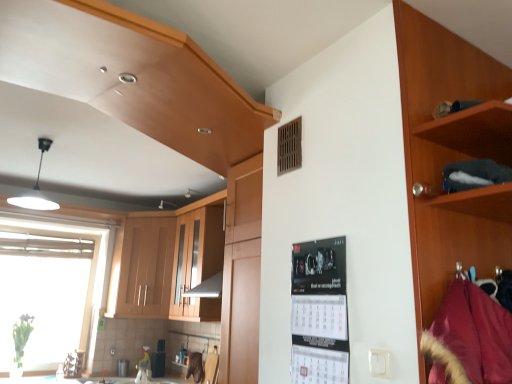
What do you see at coordinates (50, 288) in the screenshot?
I see `transparent glass window at left` at bounding box center [50, 288].

This screenshot has width=512, height=384. What do you see at coordinates (198, 258) in the screenshot? I see `matte wood cabinet at center, the second cabinetry when ordered from front to back` at bounding box center [198, 258].

The width and height of the screenshot is (512, 384). Describe the element at coordinates (142, 268) in the screenshot. I see `wooden cabinet at upper left, positioned as the 1th cabinetry in left-to-right order` at that location.

In the scene shown: Measure the distance between point (380,369) and camera.

Point (380,369) is 4.16 feet away from camera.

The width and height of the screenshot is (512, 384). What do you see at coordinates (469, 338) in the screenshot?
I see `velvet burgundy coat at right` at bounding box center [469, 338].

Locate an element on the screen. Image resolution: width=512 pixels, height=384 pixels. wooden cabinet at right, which ranks as the third cabinetry in left-to-right order is located at coordinates (451, 155).

Do you think transparent glass window at left is within white glossy countertop at lower center, or outside of it?

transparent glass window at left cannot be found inside white glossy countertop at lower center.

From the picture: Between transparent glass window at left and white glossy countertop at lower center, which one has smaller width?

transparent glass window at left is thinner.

Does point (94, 313) come in front of point (164, 379)?

That is False.

Which object is further away from the camera, transparent glass window at left or white glossy countertop at lower center?

transparent glass window at left is more distant.

How far apart are transparent glass window at left and dark brown wood at upper right?

transparent glass window at left is 3.98 meters away from dark brown wood at upper right.

Which object is closer to the camera taking this photo, transparent glass window at left or dark brown wood at upper right?

dark brown wood at upper right is closer to the camera.

Considering the sizes of objects transparent glass window at left and dark brown wood at upper right in the image provided, who is taller, transparent glass window at left or dark brown wood at upper right?

Standing taller between the two is transparent glass window at left.

From the image's perspective, would you say black paper calendar at center is shown under matte wood cabinet at center, the 2th cabinetry viewed from the left?

No, from the image's perspective, black paper calendar at center is not beneath matte wood cabinet at center, the 2th cabinetry viewed from the left.

Is black paper calendar at center in front of or behind matte wood cabinet at center, the second cabinetry positioned from the right, in the image?

black paper calendar at center is positioned closer to the viewer than matte wood cabinet at center, the second cabinetry positioned from the right.

From a real-world perspective, is black paper calendar at center above or below matte wood cabinet at center, which appears as the second cabinetry when viewed from the back?

In terms of real-world spatial position, black paper calendar at center is below matte wood cabinet at center, which appears as the second cabinetry when viewed from the back.

Between point (298, 353) and point (220, 195), which one is positioned in front?

The point (298, 353) is closer.

Is velvet burgundy coat at right not within matte wood cabinet at center, which appears as the second cabinetry when viewed from the back?

Yes, velvet burgundy coat at right is not within matte wood cabinet at center, which appears as the second cabinetry when viewed from the back.

Between velvet burgundy coat at right and matte wood cabinet at center, the second cabinetry when ordered from front to back, which one has less height?

velvet burgundy coat at right.

How many degrees apart are the facing directions of velvet burgundy coat at right and matte wood cabinet at center, which appears as the second cabinetry when viewed from the back?

The facing directions of velvet burgundy coat at right and matte wood cabinet at center, which appears as the second cabinetry when viewed from the back, are 91.9 degrees apart.

Based on their positions, is velvet burgundy coat at right located to the left or right of matte wood cabinet at center, the second cabinetry when ordered from front to back?

velvet burgundy coat at right is to the right of matte wood cabinet at center, the second cabinetry when ordered from front to back.

Do you think white plastic electric outlet at lower right is within black paper calendar at center, or outside of it?

white plastic electric outlet at lower right is not inside black paper calendar at center, it's outside.

Based on the photo, is white plastic electric outlet at lower right oriented away from black paper calendar at center?

No, white plastic electric outlet at lower right is not facing away from black paper calendar at center.

From a real-world perspective, is white plastic electric outlet at lower right above or below black paper calendar at center?

white plastic electric outlet at lower right is below black paper calendar at center.

In the image, is white plastic electric outlet at lower right positioned in front of or behind black paper calendar at center?

white plastic electric outlet at lower right is in front of black paper calendar at center.

Between velvet burgundy coat at right and white glossy countertop at lower center, which one has less height?

white glossy countertop at lower center is shorter.

Who is more distant, velvet burgundy coat at right or white glossy countertop at lower center?

Positioned behind is white glossy countertop at lower center.

How different are the orientations of velvet burgundy coat at right and white glossy countertop at lower center in degrees?

The angle between the facing direction of velvet burgundy coat at right and the facing direction of white glossy countertop at lower center is 47.5 degrees.

In the scene shown: From a real-world perspective, which is physically below, velvet burgundy coat at right or white glossy countertop at lower center?

white glossy countertop at lower center is physically lower.

How different are the orientations of white plastic electric outlet at lower right and transparent glass window at left in degrees?

white plastic electric outlet at lower right and transparent glass window at left are facing 89.9 degrees away from each other.

Relative to transparent glass window at left, is white plastic electric outlet at lower right in front or behind?

Clearly, white plastic electric outlet at lower right is in front of transparent glass window at left.

In terms of size, does white plastic electric outlet at lower right appear bigger or smaller than transparent glass window at left?

Considering their sizes, white plastic electric outlet at lower right takes up less space than transparent glass window at left.

Is white plastic electric outlet at lower right placed right next to transparent glass window at left?

No.

This screenshot has height=384, width=512. I want to click on counter top below the transparent glass window at left (from the image's perspective), so click(47, 380).

Locate an element on the screen. Image resolution: width=512 pixels, height=384 pixels. shelf in front of the transparent glass window at left is located at coordinates (474, 132).

When comparing their distances from wooden cabinet at upper left, the third cabinetry from the right, does wooden cabinet at right, which is the third cabinetry in back-to-front order, or white glossy countertop at lower center seem closer?

Among the two, white glossy countertop at lower center is located nearer to wooden cabinet at upper left, the third cabinetry from the right.

Based on their spatial positions, is wooden cabinet at upper left, the third cabinetry from the right, or velvet burgundy coat at right closer to white plastic electric outlet at lower right?

velvet burgundy coat at right.

From the image, which object appears to be nearer to velvet burgundy coat at right, white plastic electric outlet at lower right or transparent glass window at left?

The object closer to velvet burgundy coat at right is white plastic electric outlet at lower right.

When comparing their distances from dark brown wood at upper right, does velvet burgundy coat at right or wooden cabinet at right, which is the third cabinetry in back-to-front order, seem closer?

The object closer to dark brown wood at upper right is wooden cabinet at right, which is the third cabinetry in back-to-front order.

Which object lies further to the anchor point wooden cabinet at upper left, positioned as the 1th cabinetry in left-to-right order, dark brown wood at upper right or white plastic electric outlet at lower right?

dark brown wood at upper right lies further to wooden cabinet at upper left, positioned as the 1th cabinetry in left-to-right order, than the other object.

Which object lies nearer to the anchor point matte wood cabinet at center, the second cabinetry positioned from the right, wooden cabinet at right, which is the third cabinetry in back-to-front order, or velvet burgundy coat at right?

wooden cabinet at right, which is the third cabinetry in back-to-front order.

Looking at the image, which one is located further to velvet burgundy coat at right, dark brown wood at upper right or transparent glass window at left?

Among the two, transparent glass window at left is located further to velvet burgundy coat at right.

From the image, which object appears to be farther from wooden cabinet at right, acting as the 1th cabinetry starting from the front, white glossy countertop at lower center or dark brown wood at upper right?

white glossy countertop at lower center.

This screenshot has height=384, width=512. Identify the location of cabinetry that lies between dark brown wood at upper right and white plastic electric outlet at lower right from top to bottom. pyautogui.click(x=451, y=155).

You are a GUI agent. You are given a task and a screenshot of the screen. Output one action in this format:
    pyautogui.click(x=<x>, y=<y>)
    Task: Click on the counter top situated between transparent glass window at left and wooden cabinet at right, the 1th cabinetry positioned from the right, from left to right
    The width and height of the screenshot is (512, 384).
    Given the screenshot: What is the action you would take?
    pyautogui.click(x=47, y=380)

Where is `cabinetry between velvet burgundy coat at right and matte wood cabinet at center, the 2th cabinetry viewed from the left, along the z-axis`? This screenshot has height=384, width=512. cabinetry between velvet burgundy coat at right and matte wood cabinet at center, the 2th cabinetry viewed from the left, along the z-axis is located at coordinates (451, 155).

I want to click on bulletin board between dark brown wood at upper right and wooden cabinet at upper left, positioned as the 1th cabinetry in left-to-right order, along the z-axis, so click(319, 312).